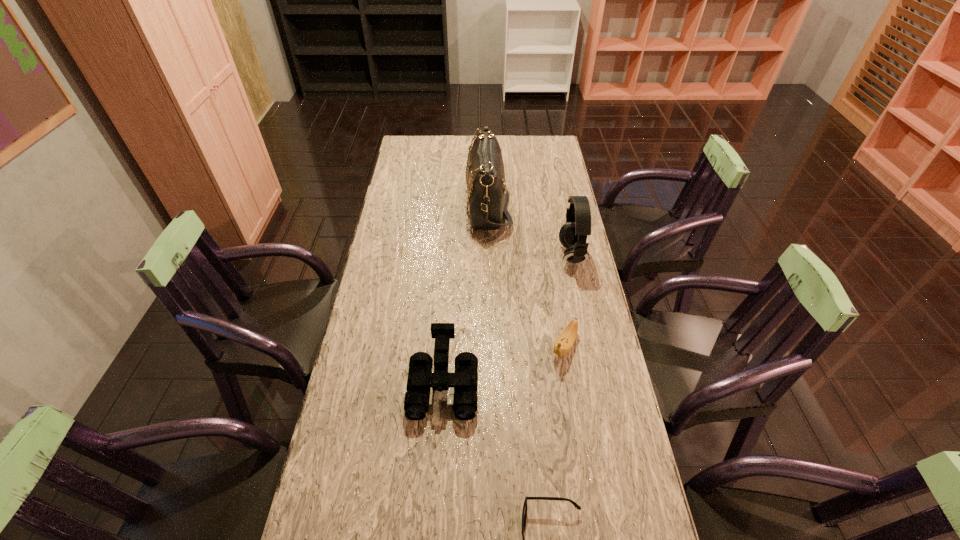
At what (x,y) coordinates should I click in order to perform the action: click on free space located on the front lenses of the binoculars. Please return your answer as a coordinate pair (x, y). Looking at the image, I should click on (436, 498).

Locate an element on the screen. Image resolution: width=960 pixels, height=540 pixels. vacant region located on the left of the fourth tallest object is located at coordinates [x=473, y=346].

Find the location of a particular element. earphone at the right edge is located at coordinates (573, 234).

The image size is (960, 540). Find the location of `banana present at the right edge`. banana present at the right edge is located at coordinates (565, 341).

This screenshot has height=540, width=960. In the image, there is a desktop. In order to click on vacant space at the far edge in this screenshot , I will do `click(444, 152)`.

In the image, there is a desktop. At what (x,y) coordinates should I click in order to perform the action: click on vacant space at the left edge. Please return your answer as a coordinate pair (x, y). Image resolution: width=960 pixels, height=540 pixels. Looking at the image, I should click on (389, 400).

The image size is (960, 540). In the image, there is a desktop. What are the coordinates of `vacant space at the right edge` in the screenshot? It's located at click(631, 478).

In the image, there is a desktop. Identify the location of vacant space at the far right corner. (526, 153).

You are a GUI agent. You are given a task and a screenshot of the screen. Output one action in this format:
    pyautogui.click(x=<x>, y=<y>)
    Task: Click on the free area in between the earphone and the banana
    The width and height of the screenshot is (960, 540).
    Given the screenshot: What is the action you would take?
    pyautogui.click(x=568, y=300)

This screenshot has height=540, width=960. I want to click on vacant area that lies between the second shortest object and the handbag, so click(526, 275).